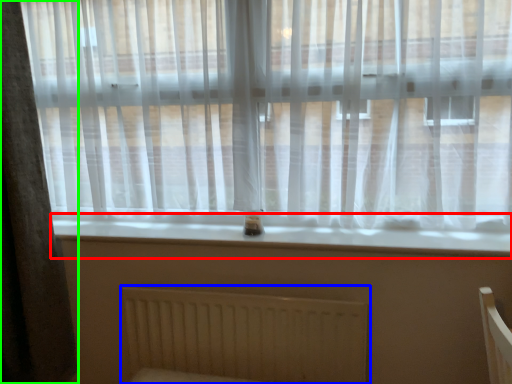
Question: Which is nearer to the window sill (highlighted by a red box)? radiator (highlighted by a blue box) or curtain (highlighted by a green box).

Choices:
 (A) radiator
 (B) curtain

Answer: (A)